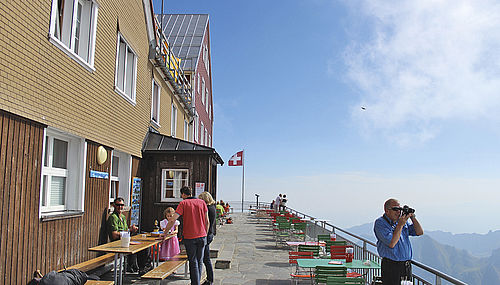
Identify the location of green table. (315, 262), (278, 223).